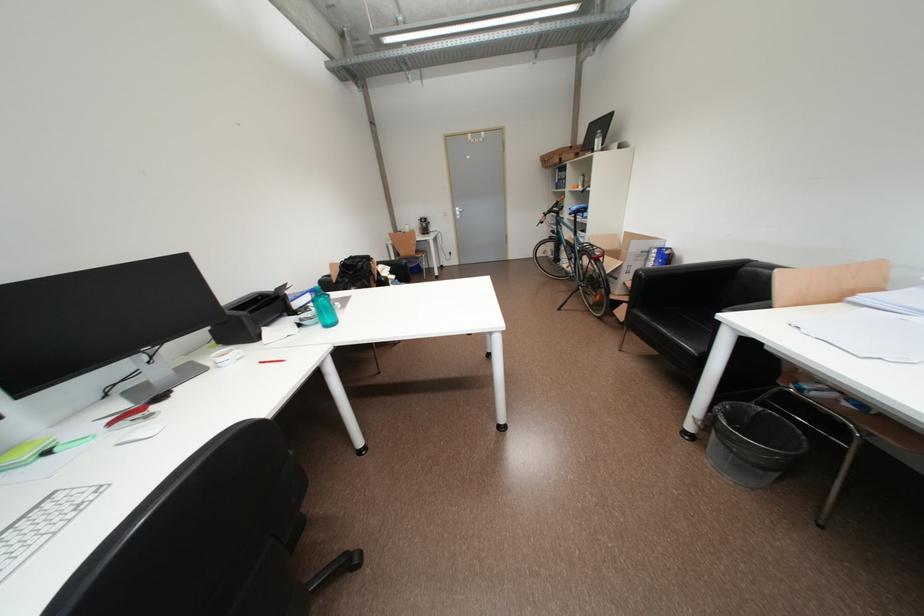
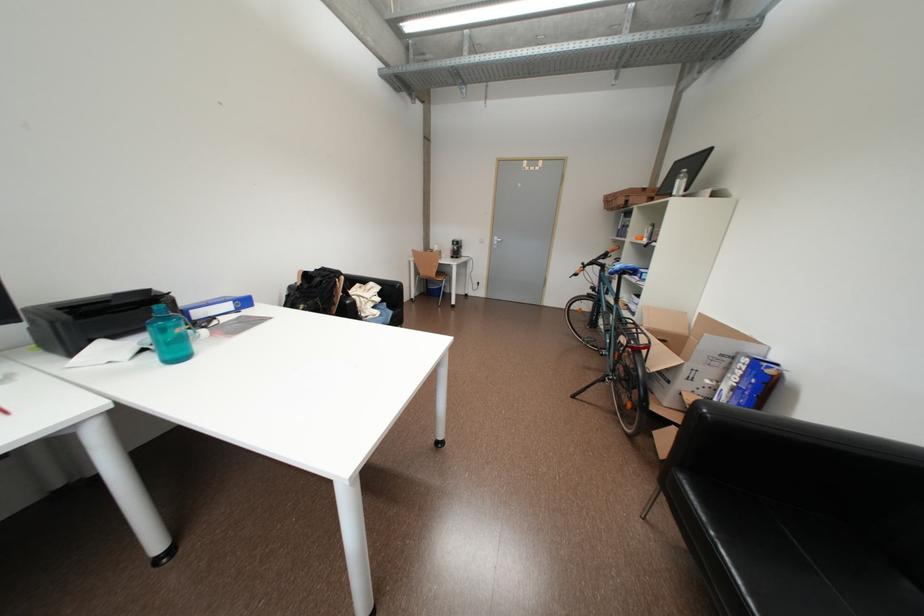
Where in the second image is the point corresponding to [462,209] from the first image?

(500, 238)